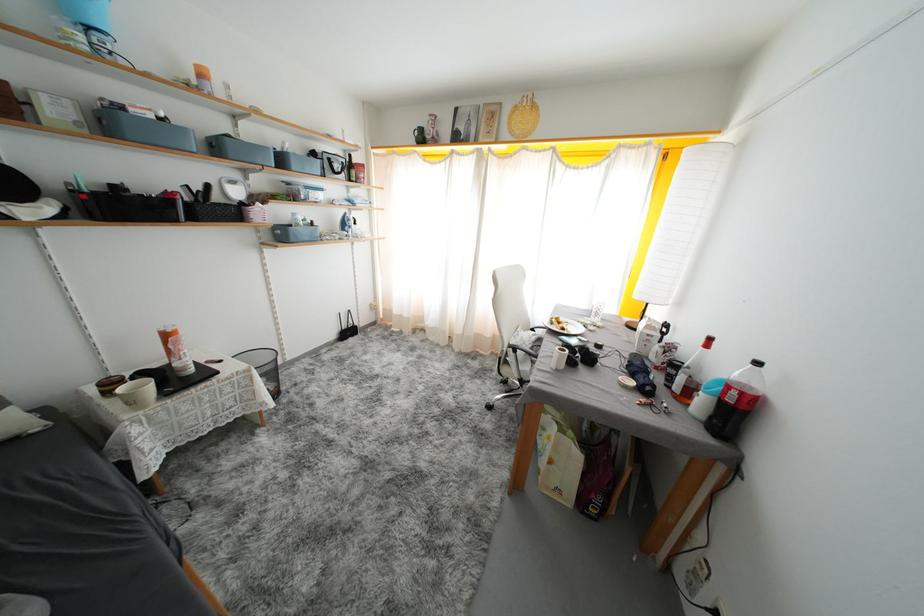
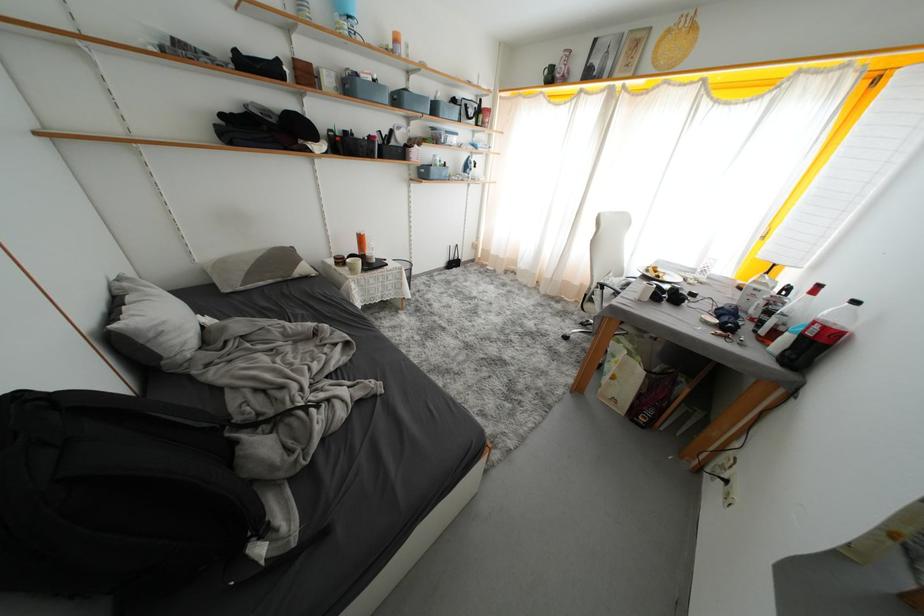
Locate, in the second image, the point that corresponds to (638,387) in the first image.

(722, 325)